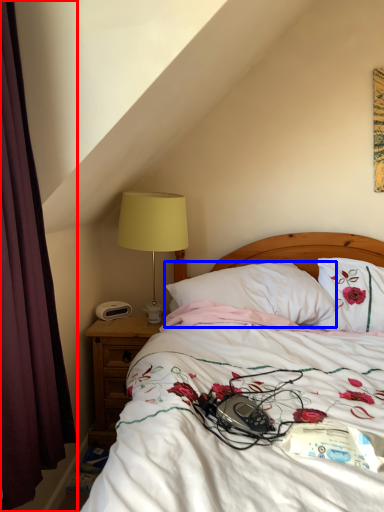
Question: Which object appears farthest to the camera in this image, curtain (highlighted by a red box) or pillow (highlighted by a blue box)?

Choices:
 (A) curtain
 (B) pillow

Answer: (B)